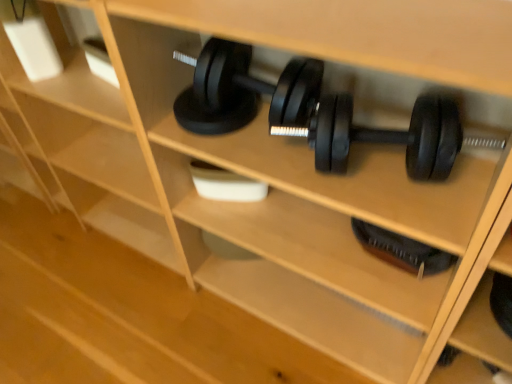
Question: From a real-world perspective, is black rubber dumbbell at center, placed as the second dumbbell when sorted from bottom to top, above or below black rubber dumbbell at lower center, which ranks as the 2th dumbbell in front-to-back order?

Choices:
 (A) above
 (B) below

Answer: (A)

Question: Is black rubber dumbbell at center, the first dumbbell when ordered from front to back, situated inside black rubber dumbbell at lower center, which is the second dumbbell from top to bottom, or outside?

Choices:
 (A) outside
 (B) inside

Answer: (A)

Question: From the image's perspective, is black rubber dumbbell at center, the first dumbbell when ordered from front to back, positioned above or below black rubber dumbbell at lower center, which is the second dumbbell from top to bottom?

Choices:
 (A) above
 (B) below

Answer: (A)

Question: From the image's perspective, is black rubber dumbbell at lower center, the 1th dumbbell in the back-to-front sequence, positioned above or below black rubber dumbbell at center, placed as the second dumbbell when sorted from bottom to top?

Choices:
 (A) above
 (B) below

Answer: (B)

Question: Would you say black rubber dumbbell at lower center, the 1th dumbbell in the back-to-front sequence, is inside or outside black rubber dumbbell at center, which appears as the second dumbbell when viewed from the back?

Choices:
 (A) outside
 (B) inside

Answer: (A)

Question: Considering the relative positions of black rubber dumbbell at lower center, the 1th dumbbell in the back-to-front sequence, and black rubber dumbbell at center, which appears as the second dumbbell when viewed from the back, in the image provided, is black rubber dumbbell at lower center, the 1th dumbbell in the back-to-front sequence, to the left or to the right of black rubber dumbbell at center, which appears as the second dumbbell when viewed from the back,?

Choices:
 (A) right
 (B) left

Answer: (A)

Question: Based on their sizes in the image, would you say black rubber dumbbell at lower center, which is the second dumbbell from top to bottom, is bigger or smaller than black rubber dumbbell at center, placed as the second dumbbell when sorted from bottom to top?

Choices:
 (A) big
 (B) small

Answer: (B)